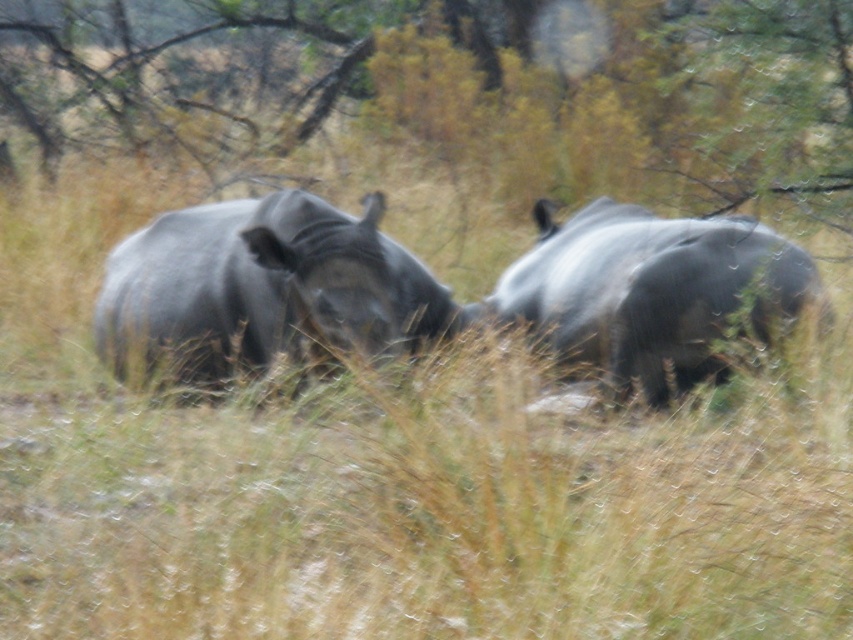
Question: Which object is the farthest from the smooth gray rhino at center?

Choices:
 (A) gray matte rhinoceros at right
 (B) brown textured tree at upper center

Answer: (B)

Question: Which object is positioned farthest from the brown textured tree at upper center?

Choices:
 (A) smooth gray rhino at center
 (B) gray matte rhinoceros at right

Answer: (A)

Question: Is brown textured tree at upper center thinner than gray matte rhinoceros at right?

Choices:
 (A) no
 (B) yes

Answer: (A)

Question: In this image, where is smooth gray rhino at center located relative to gray matte rhinoceros at right?

Choices:
 (A) above
 (B) below

Answer: (B)

Question: Is brown textured tree at upper center smaller than smooth gray rhino at center?

Choices:
 (A) yes
 (B) no

Answer: (B)

Question: Which is farther from the smooth gray rhino at center?

Choices:
 (A) gray matte rhinoceros at right
 (B) brown textured tree at upper center

Answer: (B)